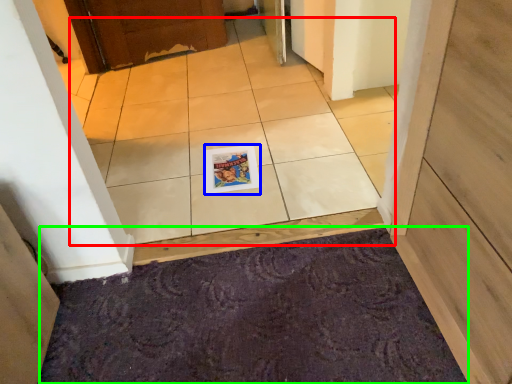
Question: Based on their relative distances, which object is nearer to ceramic tile (highlighted by a red box)? Choose from magazine (highlighted by a blue box) and doormat (highlighted by a green box).

Choices:
 (A) magazine
 (B) doormat

Answer: (A)